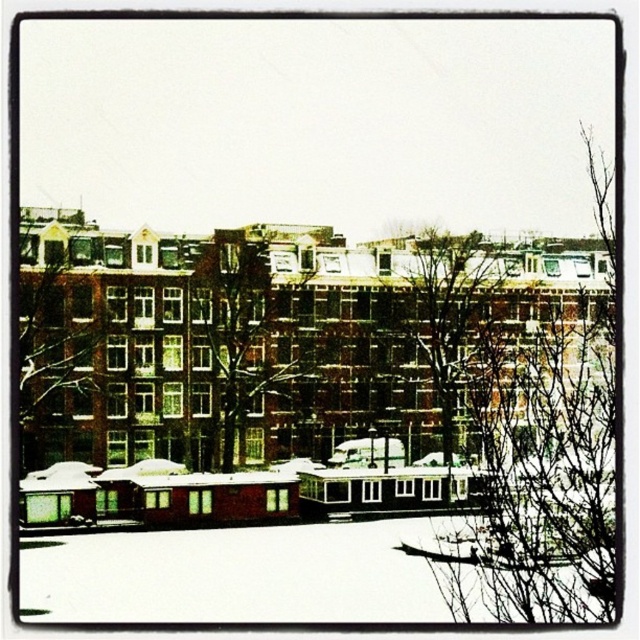
You are standing on the dock of the houseboat in the foreground and looking towards the buildings. Which tree, the brown wooden tree at upper left or the brown textured tree at center, is closer to you?

The brown wooden tree at upper left is closer to you because it is positioned below the brown textured tree at center, indicating it is in a lower spatial plane and thus nearer in the visual perspective.

You are standing at the edge of the canal and see the brown textured tree at center. If you want to walk directly to the tree, how many steps would you need to take if each step covers about 2.5 feet?

The brown textured tree at center is 358.93 feet away. Dividing the distance by the step length of 2.5 feet per step gives approximately 143.57 steps. Since you can only take whole steps, you would need to take around 144 steps to reach the tree.